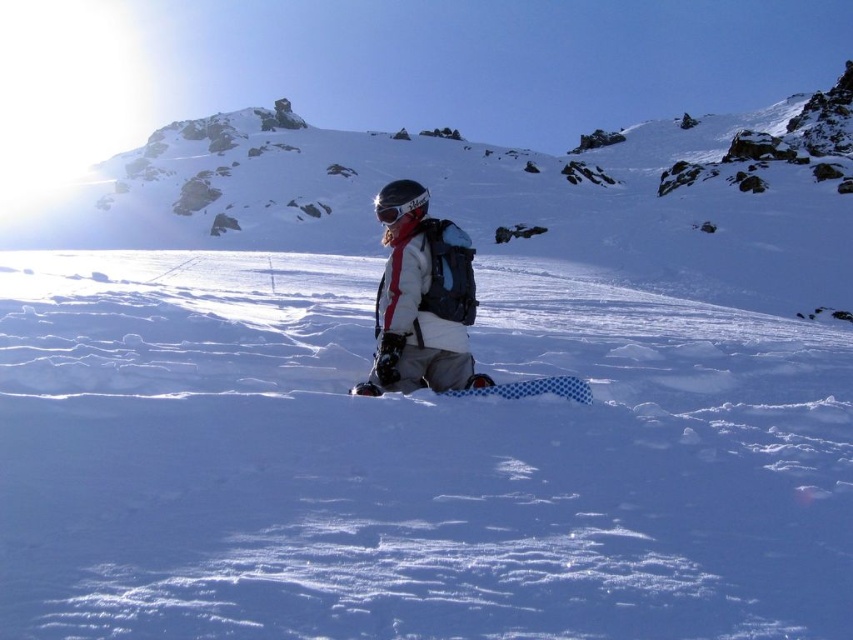
Does blue checkered snowboard at center appear on the right side of matte black goggles at center?

Correct, you'll find blue checkered snowboard at center to the right of matte black goggles at center.

Can you confirm if blue checkered snowboard at center is shorter than matte black goggles at center?

Indeed, blue checkered snowboard at center has a lesser height compared to matte black goggles at center.

Image resolution: width=853 pixels, height=640 pixels. Identify the location of blue checkered snowboard at center. (535, 388).

Can you confirm if white matte jacket at center is positioned to the right of blue checkered snowboard at center?

Incorrect, white matte jacket at center is not on the right side of blue checkered snowboard at center.

Who is more distant from viewer, (438, 262) or (479, 394)?

The point (438, 262) is behind.

Does point (427, 378) come in front of point (575, 381)?

No, (427, 378) is behind (575, 381).

Find the location of a particular element. This screenshot has width=853, height=640. white matte jacket at center is located at coordinates (422, 298).

Between white matte jacket at center and matte black goggles at center, which one appears on the right side from the viewer's perspective?

white matte jacket at center

Does point (407, 264) come behind point (418, 200)?

No, it is not.

Who is more distant from viewer, [386,376] or [425,192]?

Point [425,192]

The width and height of the screenshot is (853, 640). What are the coordinates of `white matte jacket at center` in the screenshot? It's located at (422, 298).